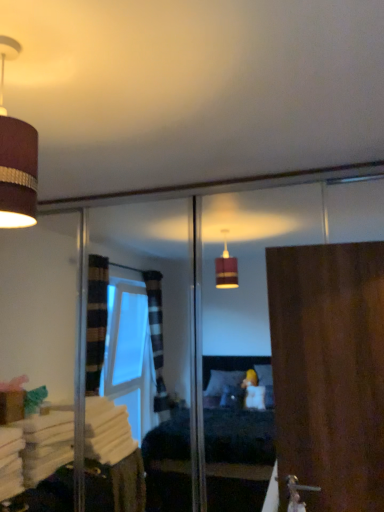
Question: Does matte brown lampshade at upper left have a larger size compared to wooden door at right?

Choices:
 (A) yes
 (B) no

Answer: (B)

Question: Are matte brown lampshade at upper left and wooden door at right far apart?

Choices:
 (A) yes
 (B) no

Answer: (A)

Question: Does matte brown lampshade at upper left have a greater width compared to wooden door at right?

Choices:
 (A) yes
 (B) no

Answer: (A)

Question: From the image's perspective, does matte brown lampshade at upper left appear higher than wooden door at right?

Choices:
 (A) no
 (B) yes

Answer: (B)

Question: Could you tell me if matte brown lampshade at upper left is turned towards wooden door at right?

Choices:
 (A) yes
 (B) no

Answer: (B)

Question: Is matte brown lampshade at upper left shorter than wooden door at right?

Choices:
 (A) no
 (B) yes

Answer: (B)

Question: Is wooden door at right to the left of matte brown lampshade at upper left from the viewer's perspective?

Choices:
 (A) no
 (B) yes

Answer: (A)

Question: From the image's perspective, would you say wooden door at right is positioned over matte brown lampshade at upper left?

Choices:
 (A) no
 (B) yes

Answer: (A)

Question: Is wooden door at right wider than matte brown lampshade at upper left?

Choices:
 (A) no
 (B) yes

Answer: (A)

Question: Is wooden door at right smaller than matte brown lampshade at upper left?

Choices:
 (A) yes
 (B) no

Answer: (B)

Question: Does wooden door at right lie behind matte brown lampshade at upper left?

Choices:
 (A) yes
 (B) no

Answer: (A)

Question: Is wooden door at right shorter than matte brown lampshade at upper left?

Choices:
 (A) yes
 (B) no

Answer: (B)

Question: From the image's perspective, is wooden door at right positioned above or below matte brown lampshade at upper left?

Choices:
 (A) above
 (B) below

Answer: (B)